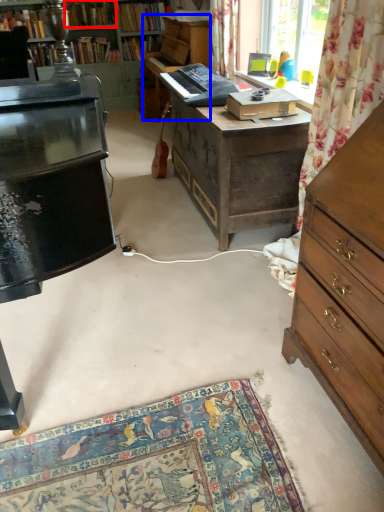
Question: Which object appears farthest to the camera in this image, book (highlighted by a red box) or piano (highlighted by a blue box)?

Choices:
 (A) book
 (B) piano

Answer: (A)